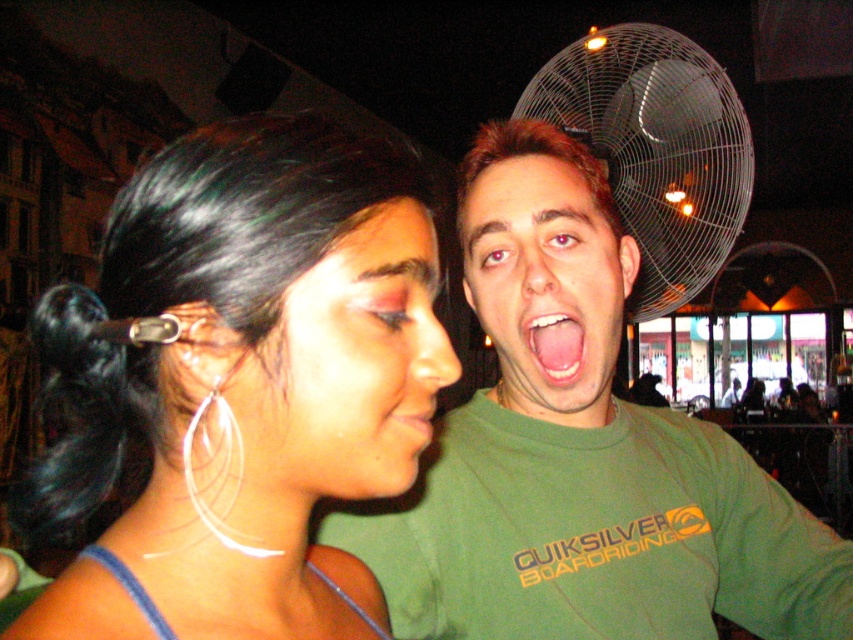
Is point (340, 273) positioned before point (395, 408)?

Yes, it is.

Does matte pink eye shadow at center have a lesser height compared to matte pink lips at center?

Incorrect, matte pink eye shadow at center's height does not fall short of matte pink lips at center's.

Between point (310, 356) and point (408, 416), which one is positioned behind?

Positioned behind is point (408, 416).

Identify the location of matte pink eye shadow at center. (349, 364).

Is point (281, 392) farther from camera compared to point (550, 337)?

No, (281, 392) is closer to viewer.

Is shiny silver hoop earring at upper left smaller than pink glossy tongue at center?

No.

Locate an element on the screen. The height and width of the screenshot is (640, 853). shiny silver hoop earring at upper left is located at coordinates (236, 387).

Who is higher up, shiny silver hoop earring at upper left or black metallic fan at upper right?

black metallic fan at upper right is higher up.

Is shiny silver hoop earring at upper left further to the viewer compared to black metallic fan at upper right?

No, it is not.

Does point (310, 273) come behind point (659, 70)?

No, it is in front of (659, 70).

What are the coordinates of `shiny silver hoop earring at upper left` in the screenshot? It's located at (236, 387).